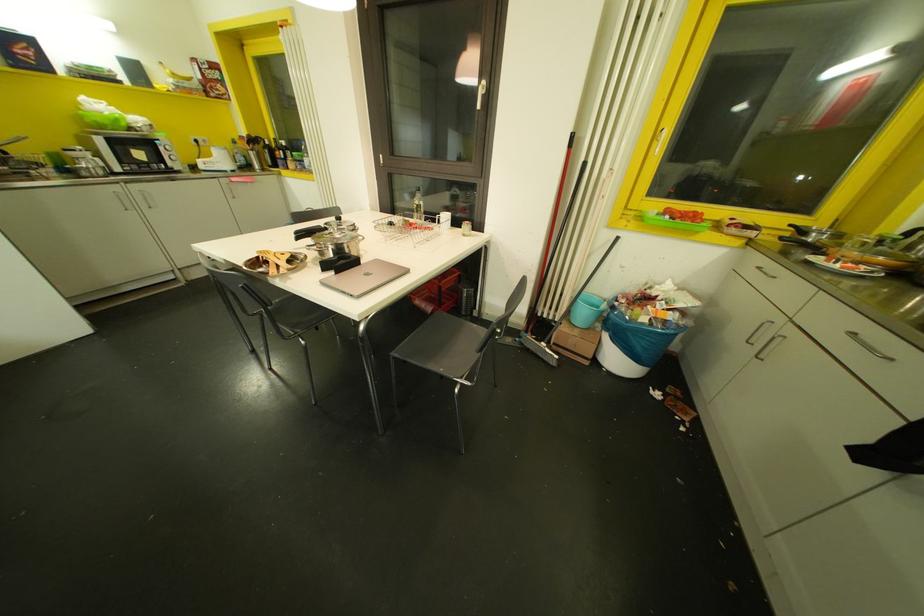
This screenshot has height=616, width=924. What do you see at coordinates (308, 232) in the screenshot?
I see `the cooking pot handle` at bounding box center [308, 232].